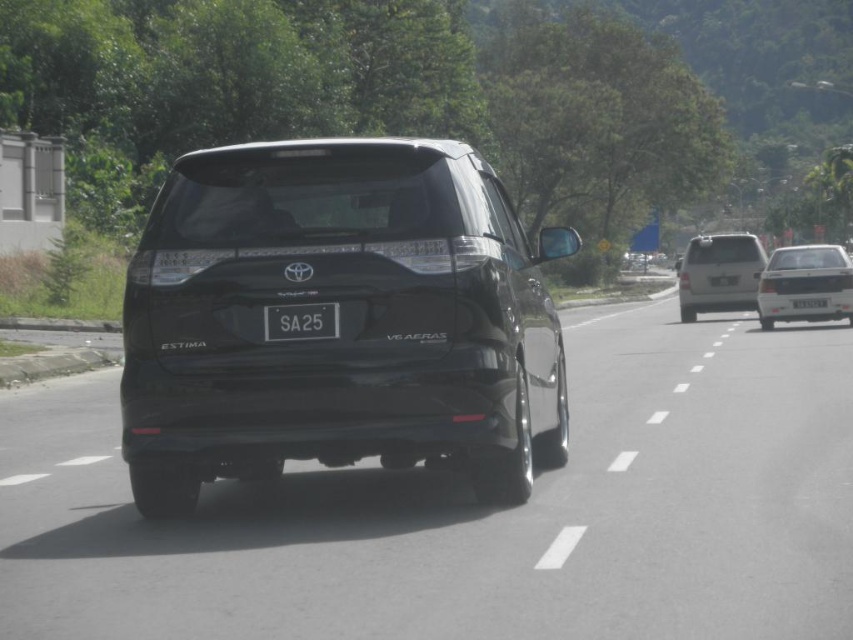
You are a driver observing the road ahead. You see a glossy black car at center and a black plastic license plate at center. Which object is nearer to you?

The glossy black car at center is closer to the viewer than the black plastic license plate at center.

You are a driver in the black Toyota Estima. You want to overtake the vehicle ahead. Can you safely see the white glossy sedan at right and the black plastic license plate at center in your rearview mirror?

The white glossy sedan at right is positioned over the black plastic license plate at center, so the sedan would block the view of the license plate in the rearview mirror, making it difficult to see both simultaneously. Therefore, overtaking might be risky as the driver cannot clearly observe both vehicles in the mirror.